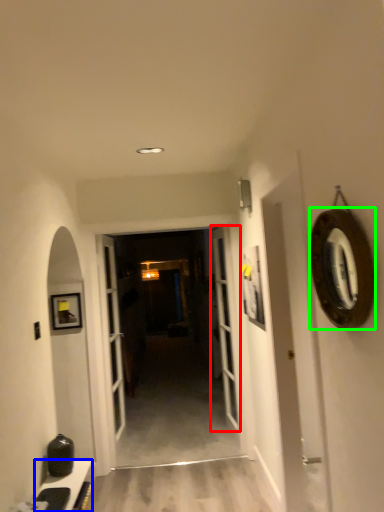
Question: Estimate the real-world distances between objects in this image. Which object is farther from door (highlighted by a red box), cabinetry (highlighted by a blue box) or oval (highlighted by a green box)?

Choices:
 (A) cabinetry
 (B) oval

Answer: (B)